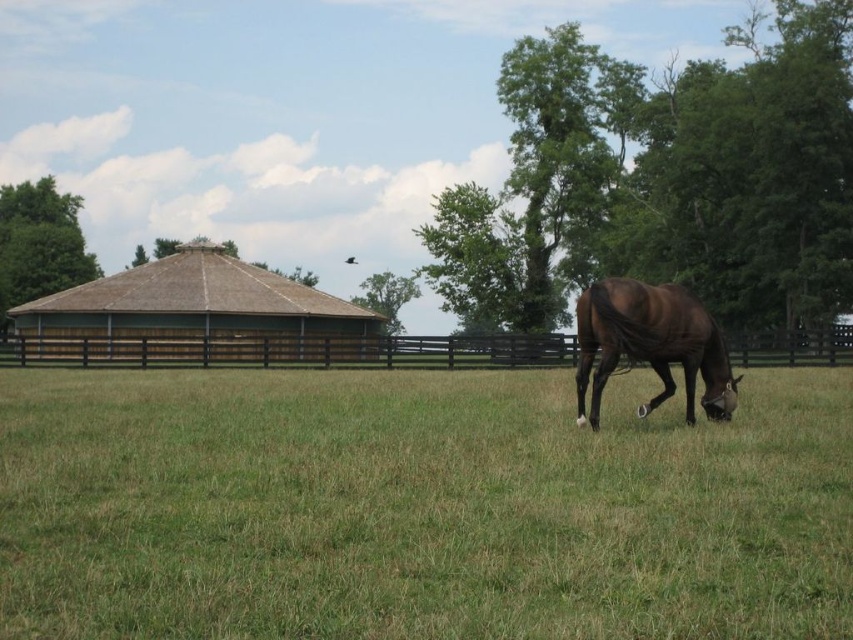
You are standing in the middle of the field and see the green leafy tree at upper right and the brown wooden fence at upper left. Which object is positioned to the east?

The green leafy tree at upper right is positioned to the east of the brown wooden fence at upper left.

You are a painter setting up an easel to paint the brown wooden fence at left and the green leafy tree at upper left. You want to ensure your painting accurately represents their sizes relative to each other. Which object should you depict as taller in your artwork?

The green leafy tree at upper left should be depicted as taller than the brown wooden fence at left in the painting since the brown wooden fence at left is shorter than the green leafy tree at upper left.